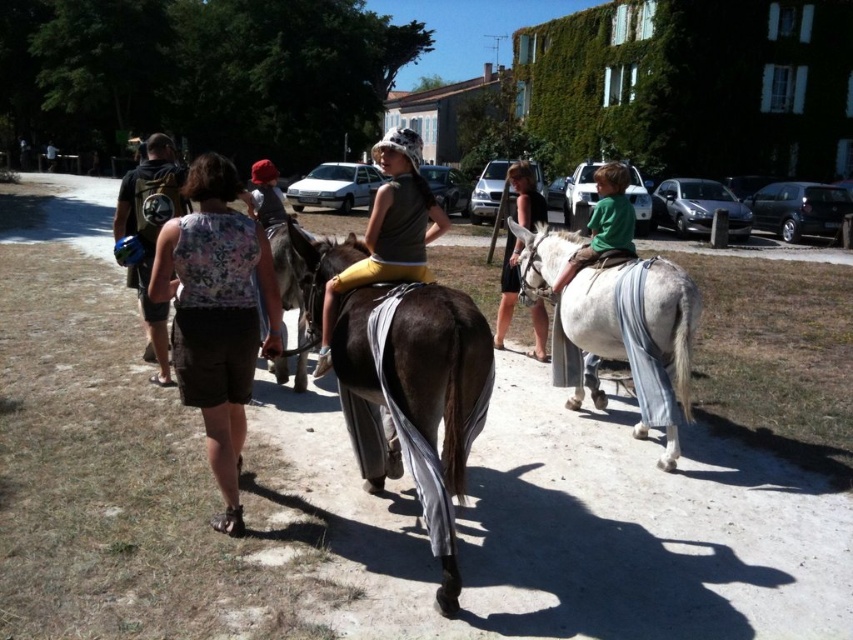
You are a photographer trying to capture a wide shot of the matte brown horse at center and the camouflage fabric backpack at left. Based on their sizes in the image, which object would you need to frame more carefully to ensure it doesn

The matte brown horse at center occupies less space than the camouflage fabric backpack at left, so you should frame the matte brown horse at center more carefully to ensure it is properly captured in the wide shot.

You are a photographer trying to capture a photo of the matte brown horse at center and the camouflage fabric backpack at left. Which object should you focus on first if you want to include both in your frame without moving the camera?

The matte brown horse at center is located below the camouflage fabric backpack at left, so you should focus on the camouflage fabric backpack at left first to ensure both are in frame.